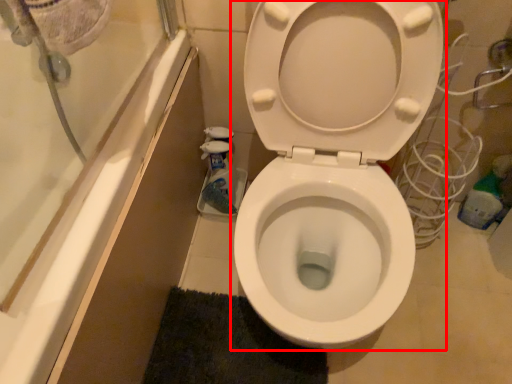
Question: From the image's perspective, considering the relative positions of toilet (annotated by the red box) and bath mat in the image provided, where is toilet (annotated by the red box) located with respect to the staircase?

Choices:
 (A) above
 (B) below

Answer: (A)